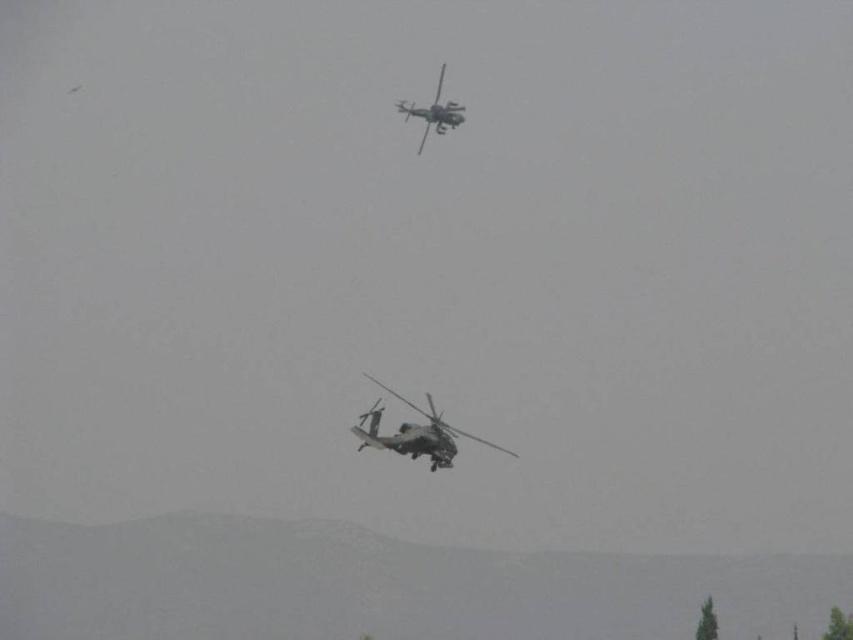
You are a drone operator trying to navigate between two points in the image. The first point is at coordinates point [428,432] and the second point is at point [439,108]. Which point is closer to the camera?

Point [428,432] is closer to the camera than point [439,108].

You are a drone pilot trying to locate a metallic gray helicopter at center in a hazy sky. The coordinates given are point at (415,433). Is this point on the metallic gray helicopter at center?

Yes, the point at (415,433) is on the metallic gray helicopter at center.